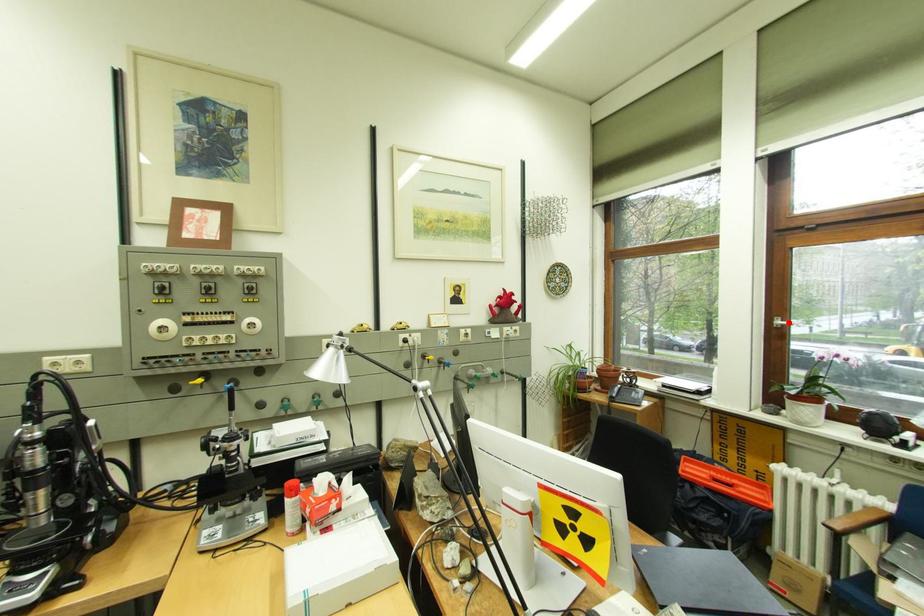
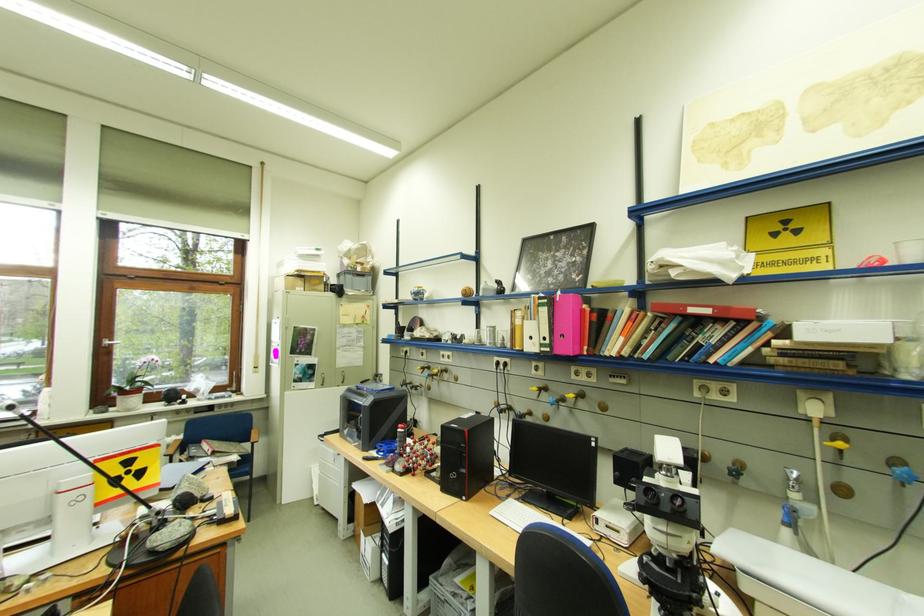
Locate, in the second image, the point that corresponds to the highlighted location in the first image.

(117, 342)